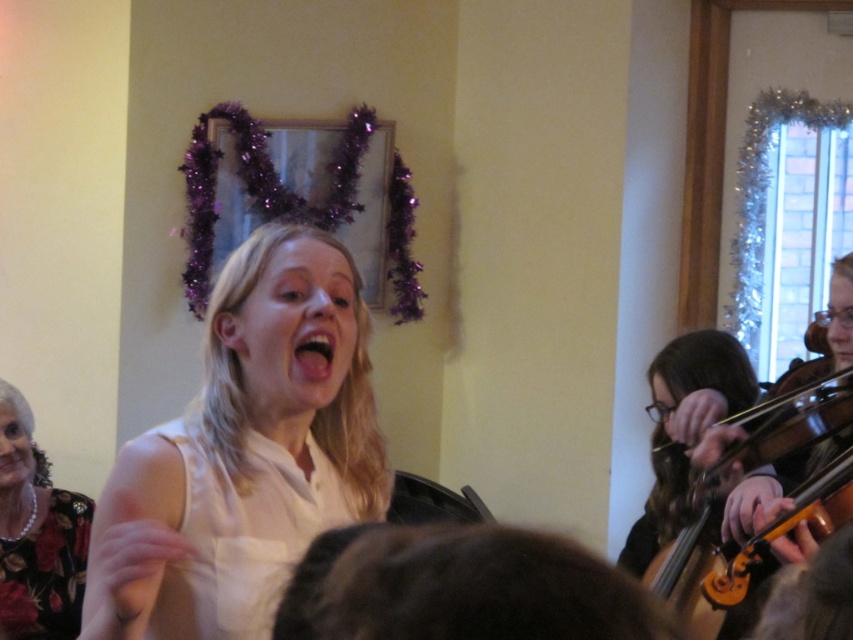
You are a photographer at the event and want to capture a photo where both the white matte shirt at center and the wooden violin at right are clearly visible. Based on their positions, which object should you focus on first to ensure both are in frame?

The white matte shirt at center is above the wooden violin at right, so focusing on the shirt first will ensure the violin is still within the lower part of the frame.

You are a photographer setting up for a group photo. You notice the white matte shirt at center and the wooden violin at right in the scene. Which object should you focus on first if you want to capture the larger object in your frame?

You should focus on the white matte shirt at center first because it is larger in size than the wooden violin at right.